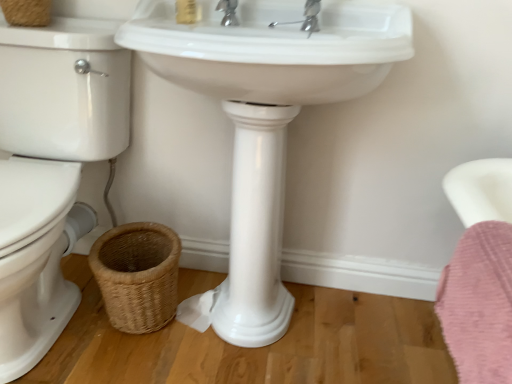
The width and height of the screenshot is (512, 384). I want to click on vacant area that lies to the right of woven brown basket at upper left, which is the first basket in left-to-right order, so click(76, 33).